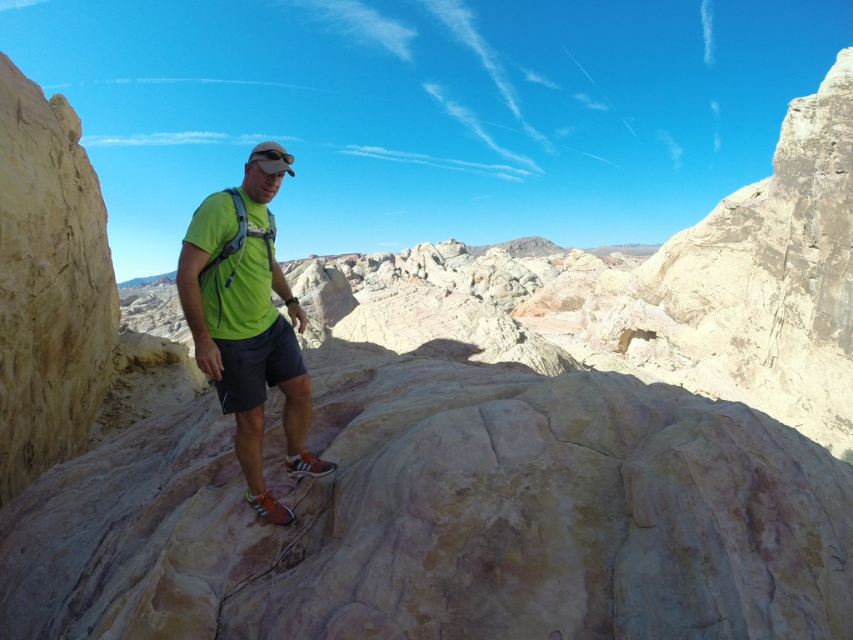
You are a hiker looking at your reflection in a nearby mirror. You notice your green matte shirt at center and black cotton shorts at center. Which piece of clothing is covering the other?

The green matte shirt at center is positioned over the black cotton shorts at center, so the green matte shirt is covering the black cotton shorts.

You are a photographer trying to capture the hiker in the image. You want to frame the shot so that the green matte shirt at center is visible to the right of the black cotton shorts at center. Is this possible?

The green matte shirt at center is to the left of the black cotton shorts at center, so it is not possible to frame the shot with the green matte shirt at center to the right of the black cotton shorts at center.

Looking at this image, you are a photographer trying to capture the hiker in the image. You want to ensure the green matte shirt at center and the black cotton shorts at center are both visible in the frame. Which clothing item should you focus on to ensure both are in the shot?

The green matte shirt at center is taller than the black cotton shorts at center. Therefore, focusing on the green matte shirt at center will ensure both items are visible as it is positioned higher up on the hiker.